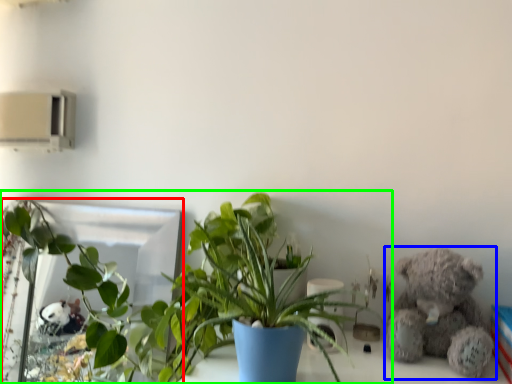
Question: Based on their relative distances, which object is farther from mirror (highlighted by a red box)? Choose from teddy bear (highlighted by a blue box) and houseplant (highlighted by a green box).

Choices:
 (A) teddy bear
 (B) houseplant

Answer: (A)